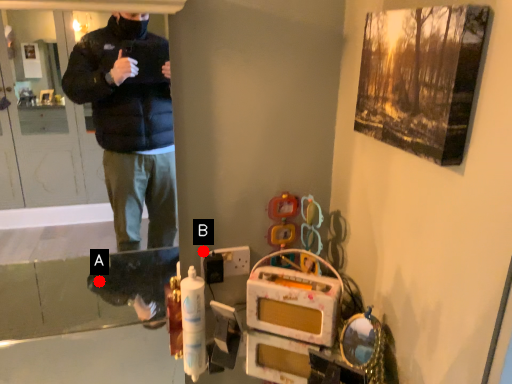
Question: Two points are circled on the image, labeled by A and B beside each circle. Which point is farther from the camera taking this photo?

Choices:
 (A) A is further
 (B) B is further

Answer: (A)